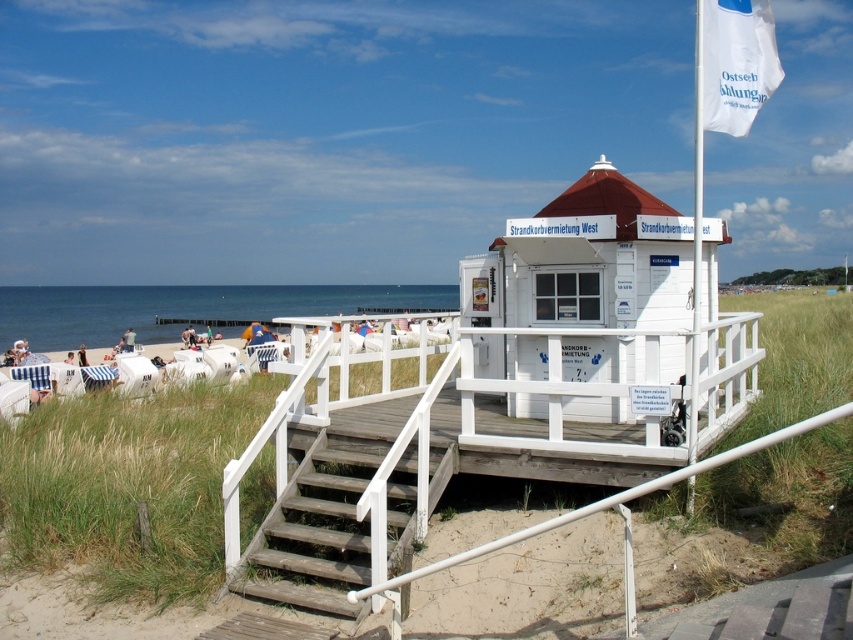
Between white wooden beach hut at center and white fabric flag at upper right, which one is positioned higher?

white fabric flag at upper right is higher up.

Between white wooden beach hut at center and white fabric flag at upper right, which one appears on the right side from the viewer's perspective?

From the viewer's perspective, white fabric flag at upper right appears more on the right side.

You are a GUI agent. You are given a task and a screenshot of the screen. Output one action in this format:
    pyautogui.click(x=<x>, y=<y>)
    Task: Click on the white wooden beach hut at center
    This screenshot has width=853, height=640.
    Given the screenshot: What is the action you would take?
    pyautogui.click(x=585, y=262)

Consider the image. Measure the distance between white wooden beach hut at center and camera.

white wooden beach hut at center is 19.16 feet from camera.

Can you confirm if white wooden beach hut at center is wider than wooden stairs at center?

Correct, the width of white wooden beach hut at center exceeds that of wooden stairs at center.

Is point (614, 300) positioned after point (328, 605)?

Yes, it is.

The image size is (853, 640). In order to click on white wooden beach hut at center in this screenshot , I will do `click(585, 262)`.

Between point (334, 442) and point (759, 65), which one is positioned behind?

The point (334, 442) is behind.

Is point (354, 545) positioned behind point (721, 35)?

Yes, point (354, 545) is behind point (721, 35).

Does point (332, 460) come farther from viewer compared to point (730, 17)?

That is True.

Image resolution: width=853 pixels, height=640 pixels. Find the location of `wooden stairs at center`. wooden stairs at center is located at coordinates tap(315, 531).